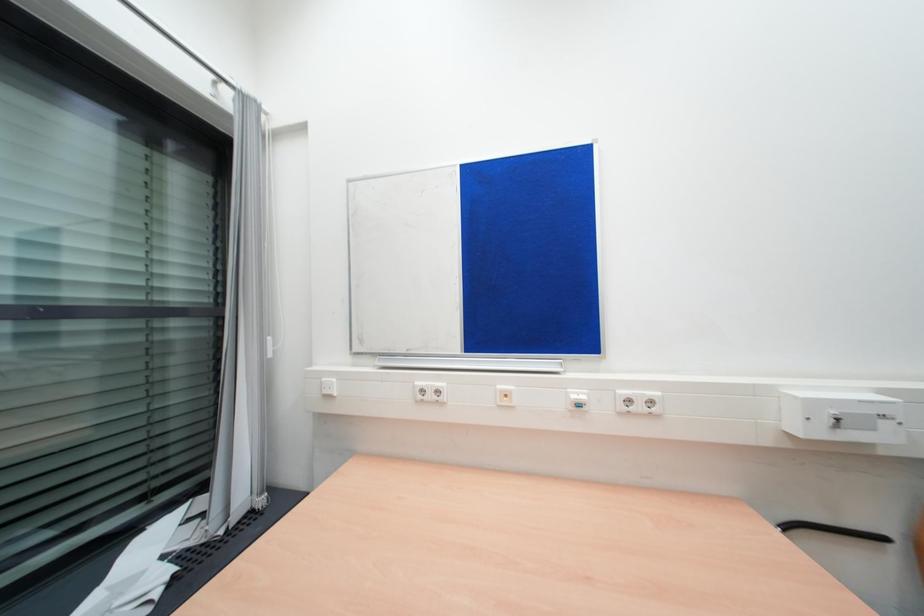
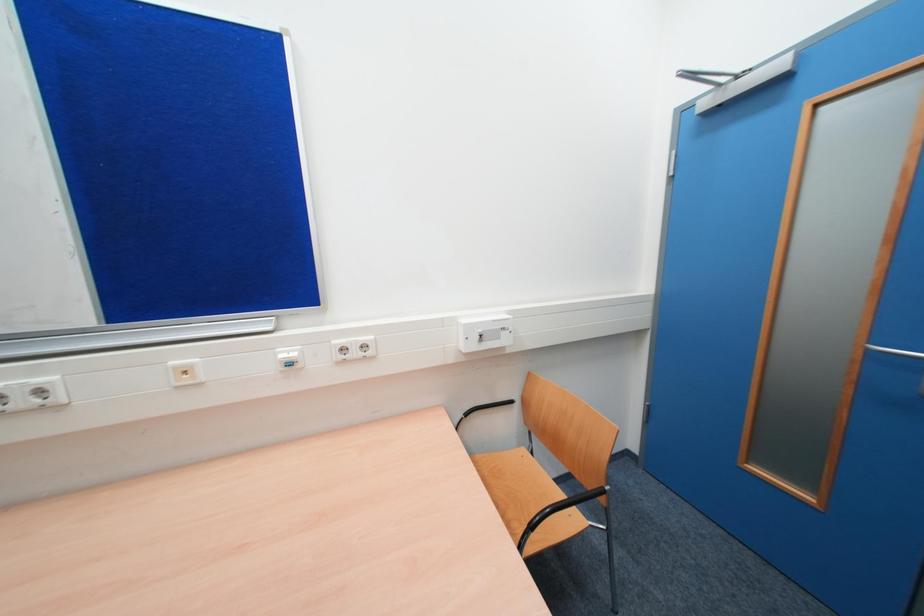
Question: The first image is from the beginning of the video and the second image is from the end. How did the camera likely rotate when shooting the video?

Choices:
 (A) Left
 (B) Right
 (C) Up
 (D) Down

Answer: (B)